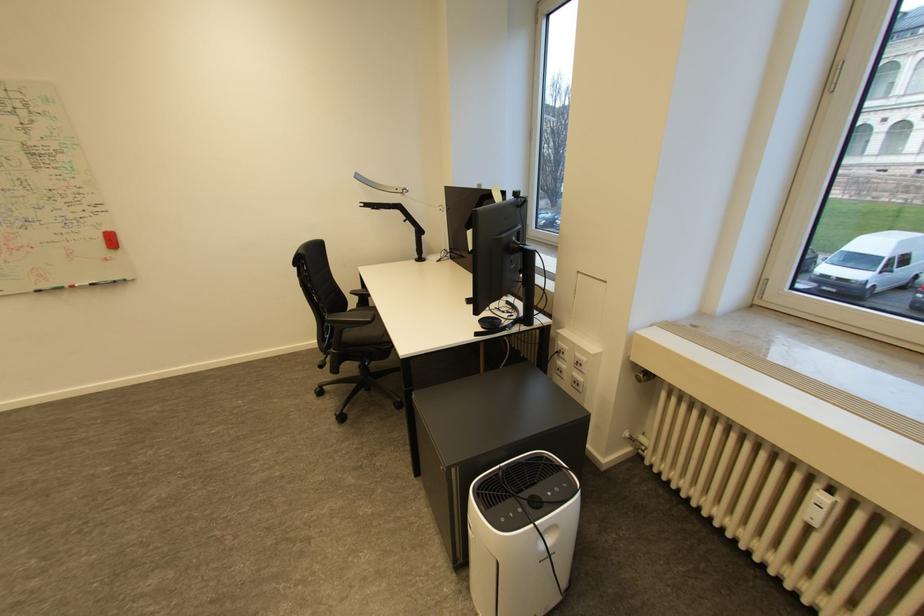
Locate an element on the screen. air purifier dial is located at coordinates (531, 503).